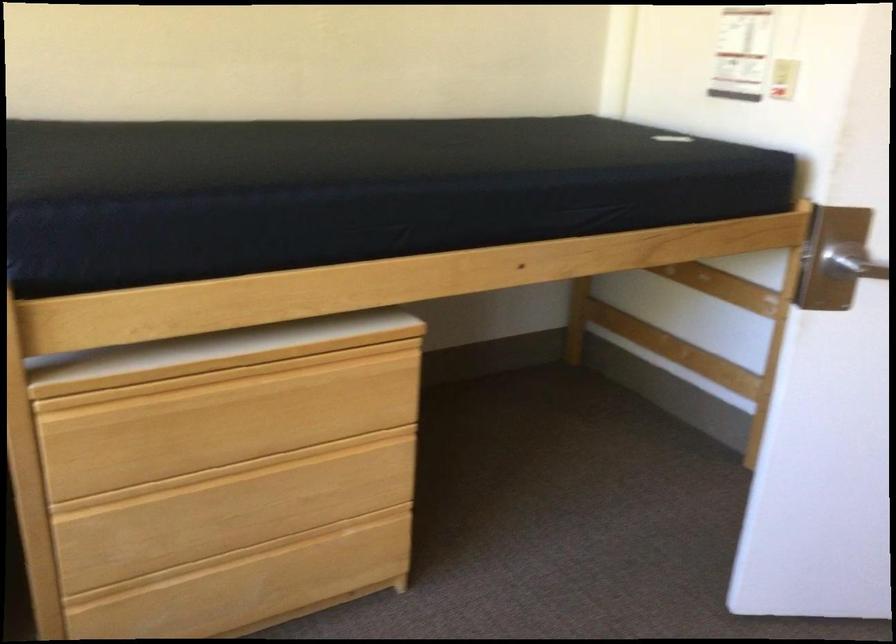
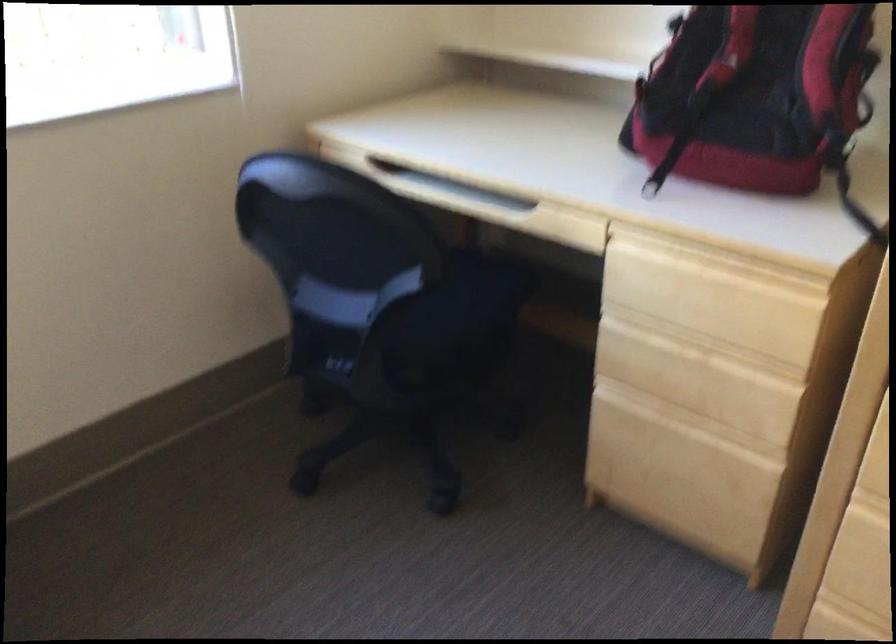
Looking at this image, first-person continuous shooting, in which direction is the camera rotating?

The camera's rotation is toward left-down.